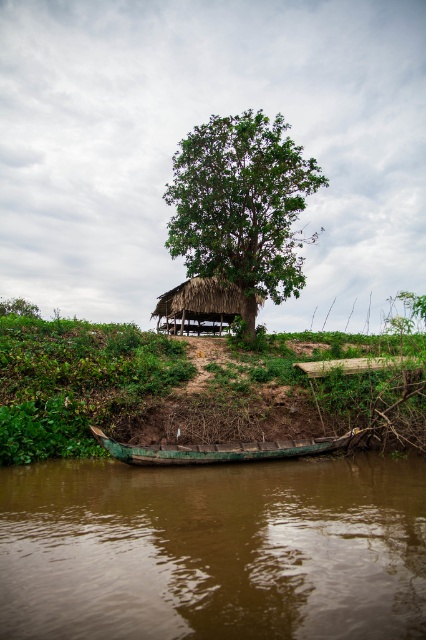
Question: Does thatched straw hut at center appear on the right side of green leafy tree at lower left?

Choices:
 (A) no
 (B) yes

Answer: (B)

Question: Is brown muddy water at lower center below green wooden boat at lower center?

Choices:
 (A) yes
 (B) no

Answer: (B)

Question: Which point appears closest to the camera in this image?

Choices:
 (A) (112, 440)
 (B) (233, 618)

Answer: (B)

Question: Which object is positioned closest to the green leafy tree at center?

Choices:
 (A) green wooden boat at lower center
 (B) green leafy tree at lower left
 (C) brown muddy water at lower center
 (D) thatched straw hut at center

Answer: (D)

Question: Which point appears farthest from the camera in this image?

Choices:
 (A) (19, 301)
 (B) (276, 483)

Answer: (A)

Question: Observing the image, what is the correct spatial positioning of green wooden boat at lower center in reference to thatched straw hut at center?

Choices:
 (A) right
 (B) left

Answer: (A)